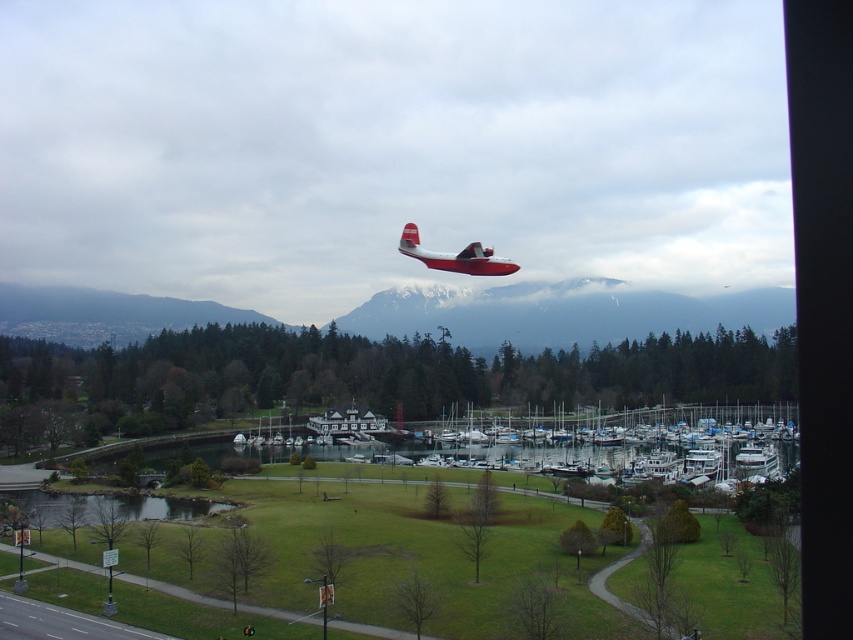
Question: Which object appears closest to the camera in this image?

Choices:
 (A) red matte seaplane at center
 (B) snowy mountain at center

Answer: (A)

Question: Is snowy mountain at center smaller than red matte seaplane at center?

Choices:
 (A) yes
 (B) no

Answer: (B)

Question: Where is snowy mountain at center located in relation to red matte seaplane at center in the image?

Choices:
 (A) below
 (B) above

Answer: (A)

Question: Does snowy mountain at center have a greater width compared to red matte seaplane at center?

Choices:
 (A) no
 (B) yes

Answer: (B)